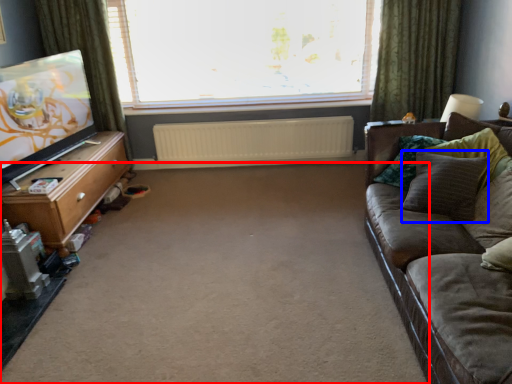
Question: Which object appears closest to the camera in this image, plain (highlighted by a red box) or pillow (highlighted by a blue box)?

Choices:
 (A) plain
 (B) pillow

Answer: (A)